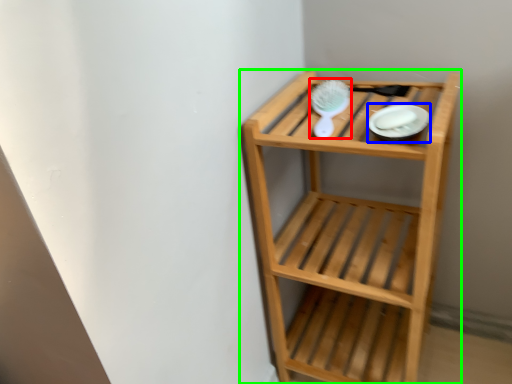
Question: Which is nearer to the brush (highlighted by a red box)? platter (highlighted by a blue box) or shelf (highlighted by a green box).

Choices:
 (A) platter
 (B) shelf

Answer: (A)